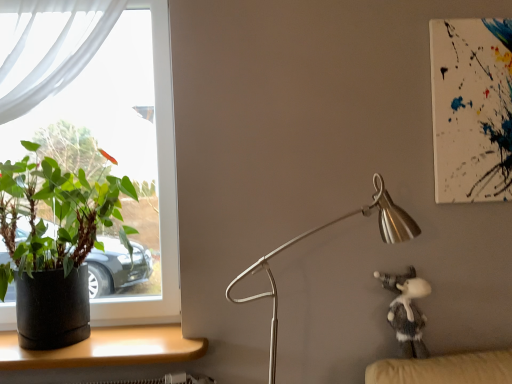
Question: Considering the relative sizes of wooden desk at lower left and silver metallic lamp at center-right in the image provided, is wooden desk at lower left wider than silver metallic lamp at center-right?

Choices:
 (A) yes
 (B) no

Answer: (A)

Question: Considering the relative sizes of wooden desk at lower left and silver metallic lamp at center-right in the image provided, is wooden desk at lower left smaller than silver metallic lamp at center-right?

Choices:
 (A) yes
 (B) no

Answer: (A)

Question: From the image's perspective, is wooden desk at lower left on silver metallic lamp at center-right?

Choices:
 (A) yes
 (B) no

Answer: (B)

Question: Does wooden desk at lower left have a lesser width compared to silver metallic lamp at center-right?

Choices:
 (A) yes
 (B) no

Answer: (B)

Question: Does wooden desk at lower left have a lesser height compared to silver metallic lamp at center-right?

Choices:
 (A) yes
 (B) no

Answer: (A)

Question: Is fuzzy gray plush at lower right in front of or behind black matte pot at left in the image?

Choices:
 (A) behind
 (B) front

Answer: (A)

Question: In terms of width, does fuzzy gray plush at lower right look wider or thinner when compared to black matte pot at left?

Choices:
 (A) wide
 (B) thin

Answer: (B)

Question: Considering the positions of point (400, 314) and point (80, 258), is point (400, 314) closer or farther from the camera than point (80, 258)?

Choices:
 (A) closer
 (B) farther

Answer: (A)

Question: Is fuzzy gray plush at lower right to the left or to the right of black matte pot at left in the image?

Choices:
 (A) right
 (B) left

Answer: (A)

Question: Is point (34, 349) positioned closer to the camera than point (106, 349)?

Choices:
 (A) closer
 (B) farther

Answer: (A)

Question: In the image, is black matte pot at left positioned in front of or behind wooden desk at lower left?

Choices:
 (A) front
 (B) behind

Answer: (A)

Question: Visually, is black matte pot at left positioned to the left or to the right of wooden desk at lower left?

Choices:
 (A) right
 (B) left

Answer: (B)

Question: Is black matte pot at left taller or shorter than wooden desk at lower left?

Choices:
 (A) tall
 (B) short

Answer: (A)

Question: Based on their positions, is clear glass window at left located to the left or right of black matte pot at left?

Choices:
 (A) left
 (B) right

Answer: (A)

Question: Relative to black matte pot at left, is clear glass window at left in front or behind?

Choices:
 (A) behind
 (B) front

Answer: (A)